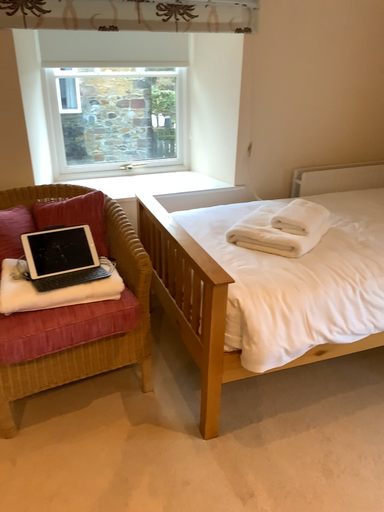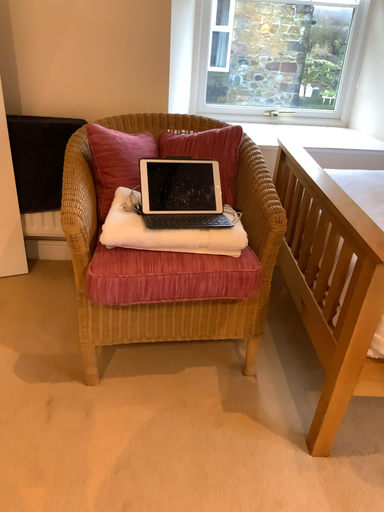
Question: Which way did the camera rotate in the video?

Choices:
 (A) rotated left
 (B) rotated right

Answer: (A)